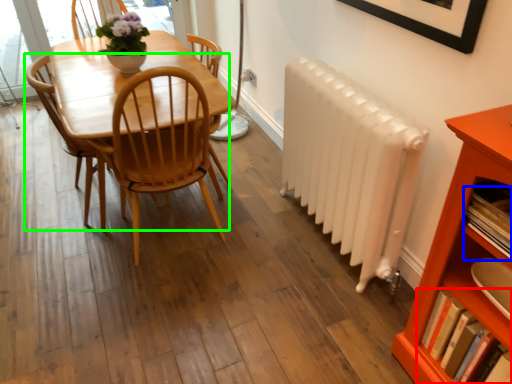
Question: Which object is the farthest from book (highlighted by a red box)? Choose among these: book (highlighted by a blue box) or chair (highlighted by a green box).

Choices:
 (A) book
 (B) chair

Answer: (B)